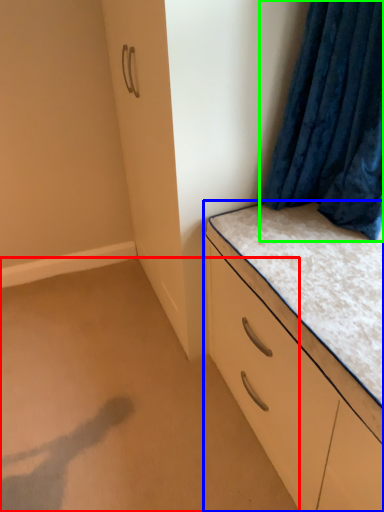
Question: Considering the real-world distances, which object is closest to plain (highlighted by a red box)? chest of drawers (highlighted by a blue box) or curtain (highlighted by a green box).

Choices:
 (A) chest of drawers
 (B) curtain

Answer: (A)